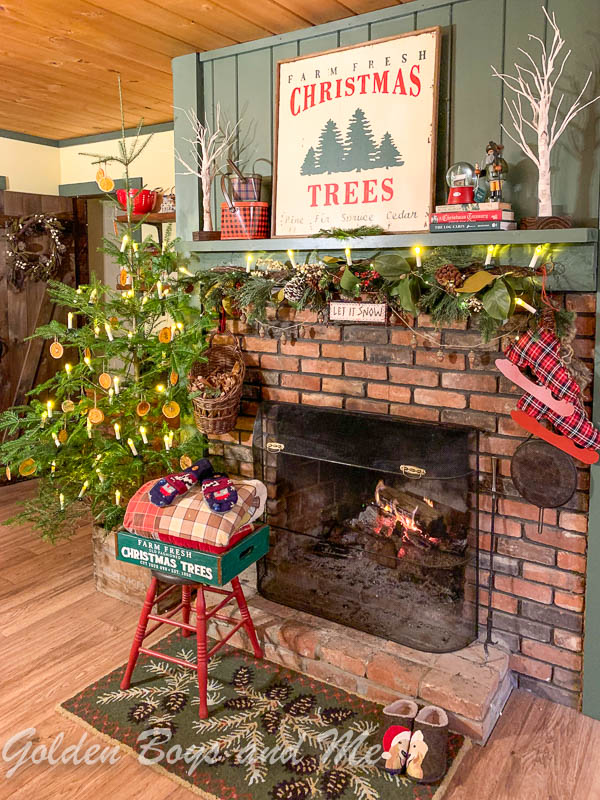
The height and width of the screenshot is (800, 600). What are the coordinates of `fire screen` in the screenshot? It's located at (261, 402), (476, 430), (476, 637), (258, 593).